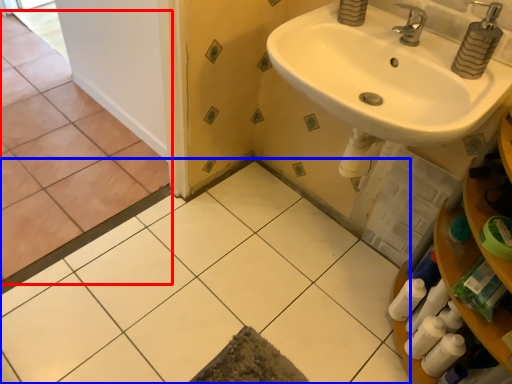
Question: Which point is further to the camera, ceramic tile (highlighted by a red box) or ceramic tile (highlighted by a blue box)?

Choices:
 (A) ceramic tile
 (B) ceramic tile

Answer: (A)